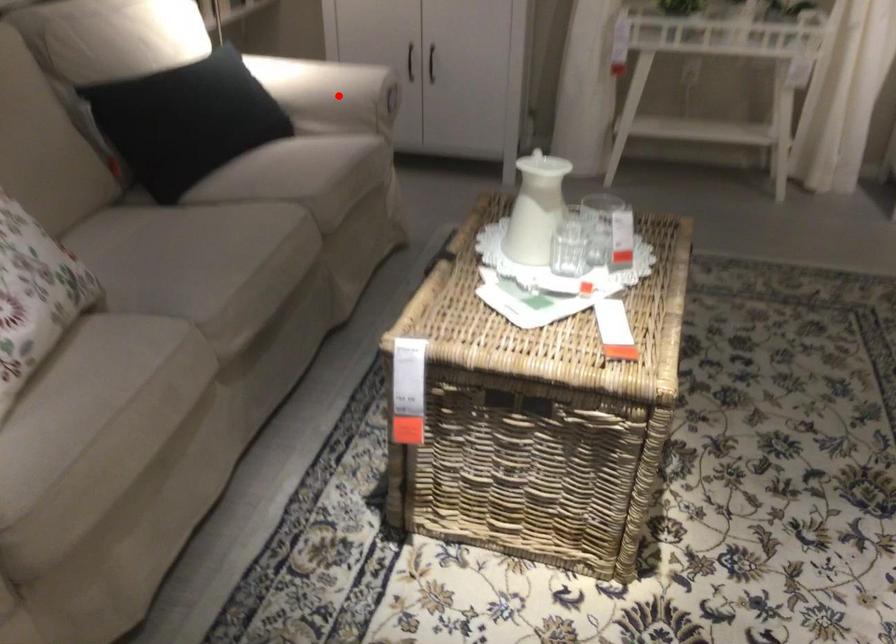
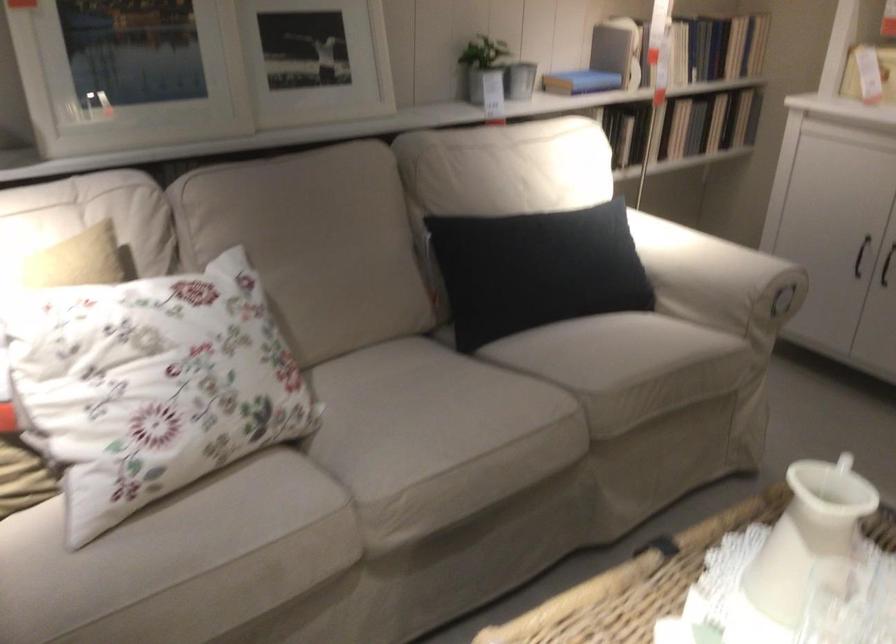
The point at the highlighted location is marked in the first image. Where is the corresponding point in the second image?

(717, 279)